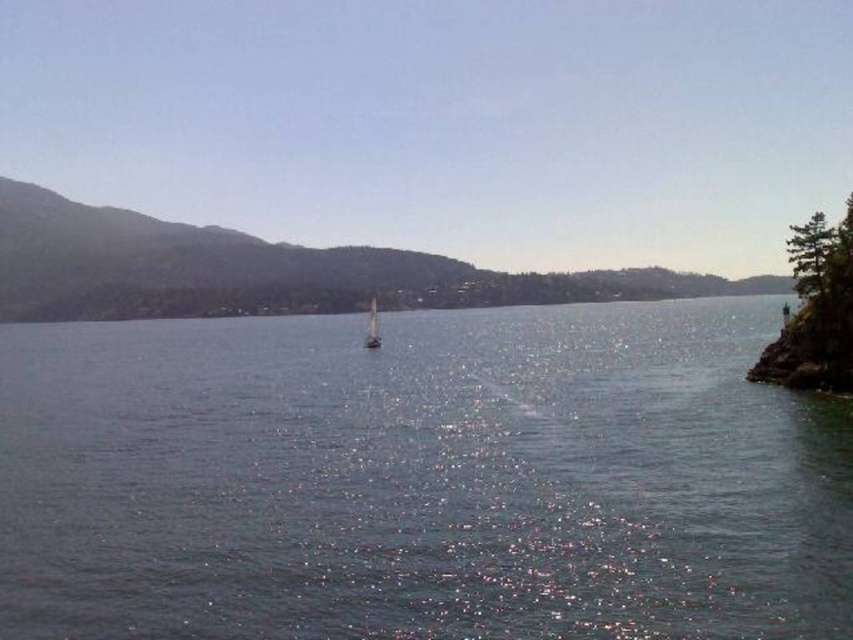
Identify the location of clear water at center. The width and height of the screenshot is (853, 640). (421, 477).

Image resolution: width=853 pixels, height=640 pixels. Identify the location of clear water at center. (421, 477).